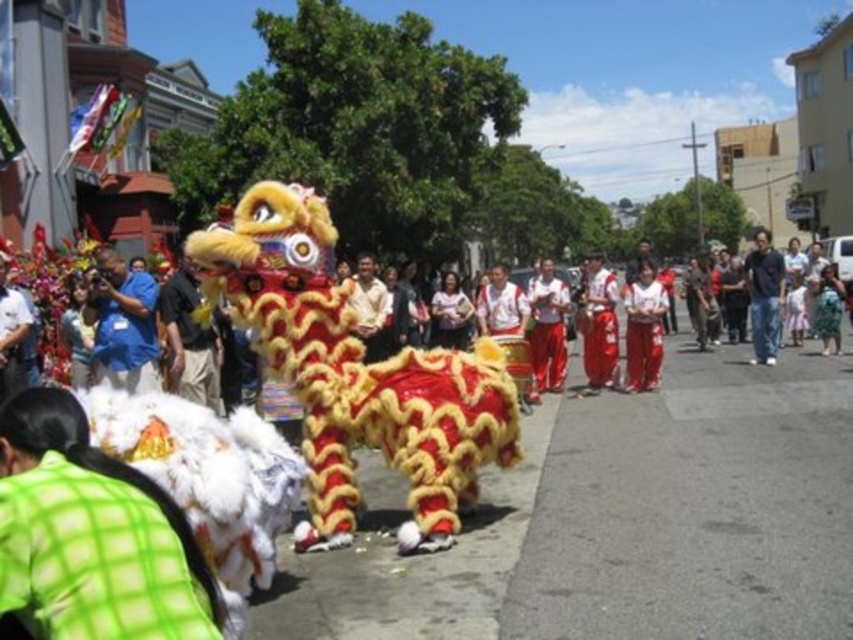
Question: Among these points, which one is farthest from the camera?

Choices:
 (A) (550, 296)
 (B) (764, 332)

Answer: (B)

Question: Can you confirm if fuzzy yellow costume at center is bigger than blue cotton shirt at center?

Choices:
 (A) no
 (B) yes

Answer: (A)

Question: Can you confirm if fuzzy yellow costume at center is smaller than matte black shirt at center?

Choices:
 (A) yes
 (B) no

Answer: (A)

Question: Which point is closer to the camera taking this photo?

Choices:
 (A) (351, 298)
 (B) (592, 348)

Answer: (A)

Question: Can you confirm if fuzzy yellow costume at center is thinner than blue cotton shirt at center?

Choices:
 (A) no
 (B) yes

Answer: (B)

Question: Among these points, which one is nearest to the camera?

Choices:
 (A) (375, 323)
 (B) (630, 364)
 (C) (758, 276)

Answer: (A)